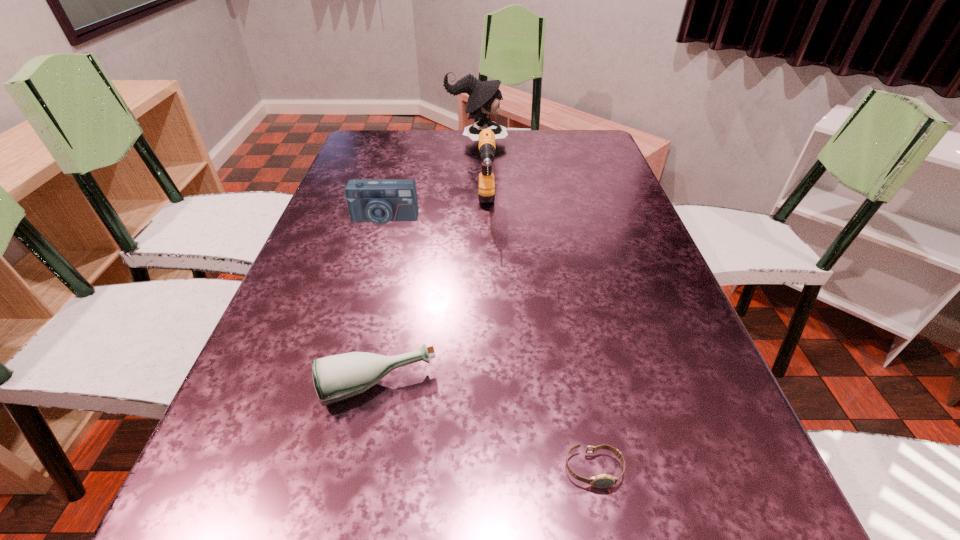
Locate an element on the screen. The width and height of the screenshot is (960, 540). free location that satisfies the following two spatial constraints: 1. at the face of the doll; 2. on the lens of the third shortest object is located at coordinates (475, 219).

This screenshot has height=540, width=960. I want to click on vacant region that satisfies the following two spatial constraints: 1. on the lens of the camera; 2. on the left side of the second shortest object, so click(x=336, y=386).